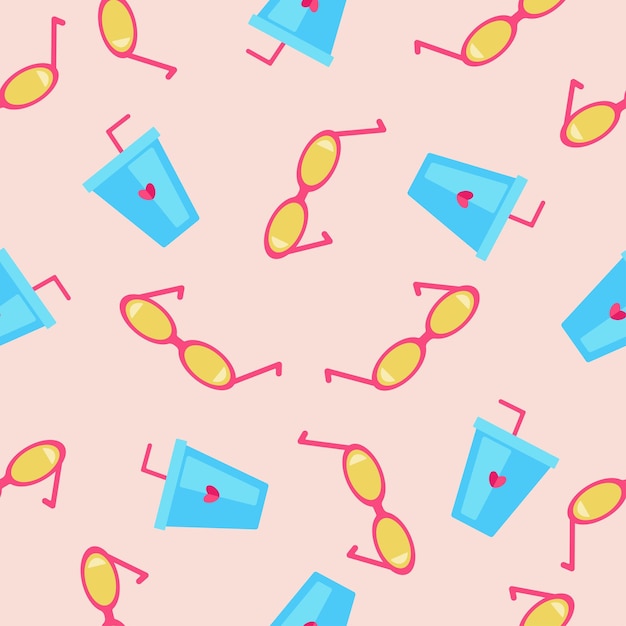
Locate an element on the screen. This screenshot has height=626, width=626. cup lid is located at coordinates point(161,516), point(47,307), point(146,139), point(321,54), point(483,245), point(545,457).